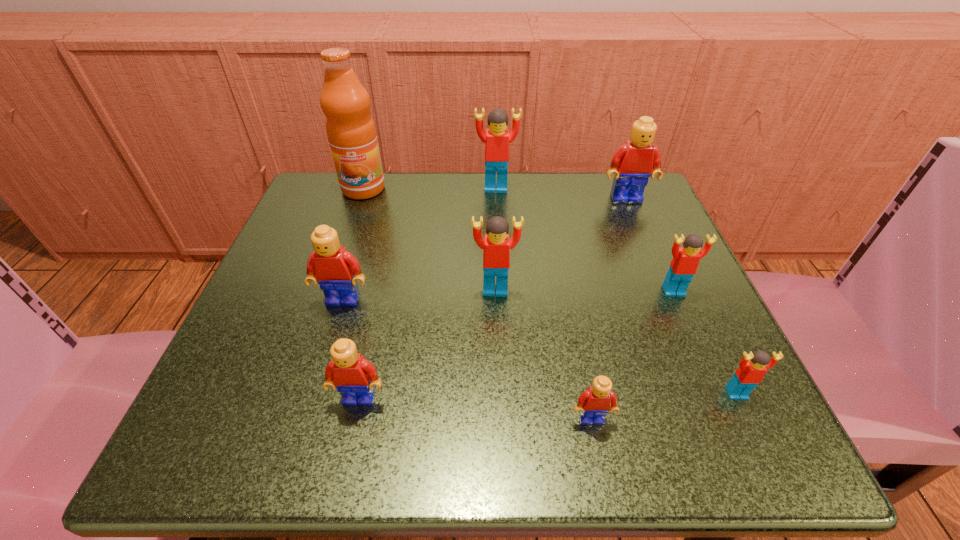
Where is `Lego that is the second nearest to the third smallest yellow Lego`? This screenshot has width=960, height=540. Lego that is the second nearest to the third smallest yellow Lego is located at coordinates (496, 255).

This screenshot has height=540, width=960. I want to click on Lego object that ranks as the second closest to the nearest red Lego, so click(x=684, y=264).

Identify which red Lego is located as the second nearest to the tallest object. Please provide its 2D coordinates. Your answer should be formatted as a tuple, i.e. [(x, y)], where the tuple contains the x and y coordinates of a point satisfying the conditions above.

[(496, 255)]

Locate an element on the screen. The image size is (960, 540). the closest red Lego to the second smallest yellow Lego is located at coordinates (496, 255).

Find the location of a particular element. This screenshot has width=960, height=540. yellow Lego that is the third closest to the third biggest red Lego is located at coordinates (354, 377).

The width and height of the screenshot is (960, 540). Identify the location of yellow Lego that is the fourth closest to the third biggest red Lego. (336, 270).